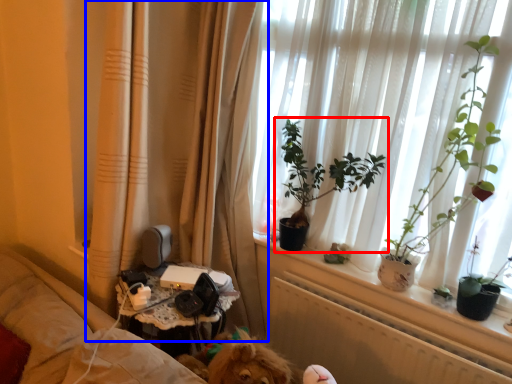
Question: Which of the following is the farthest to the observer, houseplant (highlighted by a red box) or curtain (highlighted by a blue box)?

Choices:
 (A) houseplant
 (B) curtain

Answer: (A)